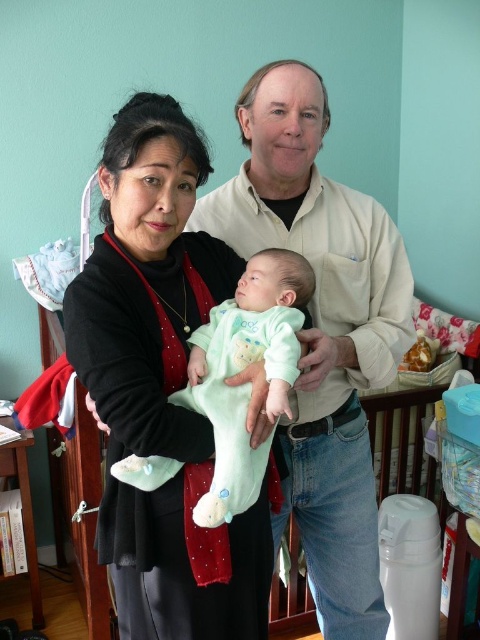
Between point (176, 120) and point (339, 234), which one is positioned behind?

The point (339, 234) is more distant.

Between black matte sweater at center and light beige cotton shirt at center, which one has less height?

black matte sweater at center

Between point (144, 369) and point (261, 88), which one is positioned behind?

The point (261, 88) is behind.

Identify the location of black matte sweater at center. (163, 387).

Between light beige cotton shirt at center and light blue soft fabric baby at center, which one is positioned higher?

Positioned higher is light blue soft fabric baby at center.

How far apart are light beige cotton shirt at center and light blue soft fabric baby at center?

light beige cotton shirt at center is 21.98 centimeters from light blue soft fabric baby at center.

What are the coordinates of `light beige cotton shirt at center` in the screenshot? It's located at (322, 332).

Is black matte sweater at center thinner than light blue soft fabric baby at center?

Incorrect, black matte sweater at center's width is not less than light blue soft fabric baby at center's.

Is black matte sweater at center taller than light blue soft fabric baby at center?

Correct, black matte sweater at center is much taller as light blue soft fabric baby at center.

Does point (186, 220) come closer to viewer compared to point (259, 458)?

That is True.

Locate an element on the screen. Image resolution: width=480 pixels, height=640 pixels. black matte sweater at center is located at coordinates (163, 387).